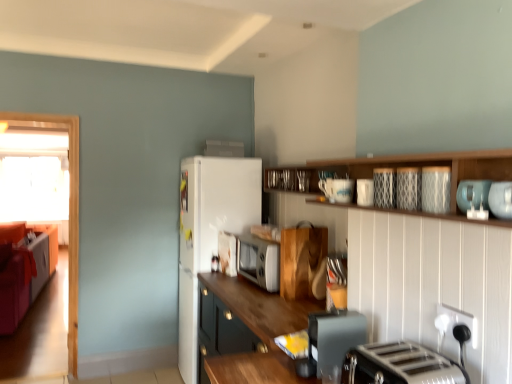
Measure the distance between point (340, 357) and camera.

4.92 feet.

Where is `wooden cutting board at center, which is the first cabinetry in top-to-bottom order`? wooden cutting board at center, which is the first cabinetry in top-to-bottom order is located at coordinates (303, 261).

How much space does porcelain textured mug at upper center, acting as the 2th appliance starting from the front, occupy vertically?

5.34 inches.

What do you see at coordinates (400, 365) in the screenshot? I see `silver metallic toaster at lower right` at bounding box center [400, 365].

What do you see at coordinates (209, 231) in the screenshot? I see `white matte refrigerator at left` at bounding box center [209, 231].

In order to click on white matte refrigerator at left in this screenshot , I will do `click(209, 231)`.

I want to click on velvet orange couch at left, so click(23, 268).

Can you confirm if silver metallic toaster at lower right is positioned to the right of wooden cutting board at center, which is the second cabinetry from bottom to top?

Correct, you'll find silver metallic toaster at lower right to the right of wooden cutting board at center, which is the second cabinetry from bottom to top.

From the image's perspective, would you say silver metallic toaster at lower right is positioned over wooden cutting board at center, which is the second cabinetry from bottom to top?

No, from the image's perspective, silver metallic toaster at lower right is not over wooden cutting board at center, which is the second cabinetry from bottom to top.

Is silver metallic toaster at lower right oriented towards wooden cutting board at center, the 1th cabinetry positioned from the back?

No, silver metallic toaster at lower right is not aimed at wooden cutting board at center, the 1th cabinetry positioned from the back.

Choose the correct answer: Is silver metallic toaster at lower right inside wooden cutting board at center, the 1th cabinetry positioned from the back, or outside it?

silver metallic toaster at lower right is located beyond the bounds of wooden cutting board at center, the 1th cabinetry positioned from the back.

From the image's perspective, is white matte refrigerator at upper center, the 7th appliance ordered from the bottom, located beneath metallic gray toaster at lower center, the fourth appliance from the back?

No, from the image's perspective, white matte refrigerator at upper center, the 7th appliance ordered from the bottom, is not beneath metallic gray toaster at lower center, the fourth appliance from the back.

From the picture: Is white matte refrigerator at upper center, which appears as the 7th appliance when viewed from the front, inside the boundaries of metallic gray toaster at lower center, the fourth appliance from the back, or outside?

The correct answer is: outside.

You are a GUI agent. You are given a task and a screenshot of the screen. Output one action in this format:
    pyautogui.click(x=<x>, y=<y>)
    Task: Click on the 6th appliance below when counting from the white matte refrigerator at upper center, which appears as the 7th appliance when viewed from the front (from the image's perspective)
    This screenshot has height=384, width=512.
    Given the screenshot: What is the action you would take?
    pyautogui.click(x=333, y=340)

Considering their positions, is white matte refrigerator at upper center, which appears as the 7th appliance when viewed from the front, located in front of or behind metallic gray toaster at lower center, acting as the seventh appliance starting from the top?

white matte refrigerator at upper center, which appears as the 7th appliance when viewed from the front, is behind metallic gray toaster at lower center, acting as the seventh appliance starting from the top.

Considering the relative positions of blue glossy toaster at upper right, acting as the 1th appliance starting from the front, and white matte refrigerator at left in the image provided, is blue glossy toaster at upper right, acting as the 1th appliance starting from the front, to the right of white matte refrigerator at left from the viewer's perspective?

Yes.

Is white matte refrigerator at left completely or partially inside blue glossy toaster at upper right, which is counted as the 4th appliance, starting from the bottom?

No, white matte refrigerator at left is not surrounded by blue glossy toaster at upper right, which is counted as the 4th appliance, starting from the bottom.

From a real-world perspective, is blue glossy toaster at upper right, which is counted as the 4th appliance, starting from the bottom, located higher than white matte refrigerator at left?

Yes, from a real-world perspective, blue glossy toaster at upper right, which is counted as the 4th appliance, starting from the bottom, is over white matte refrigerator at left

Is blue glossy toaster at upper right, acting as the 1th appliance starting from the front, bigger or smaller than white matte refrigerator at left?

In the image, blue glossy toaster at upper right, acting as the 1th appliance starting from the front, appears to be smaller than white matte refrigerator at left.

From the image's perspective, which one is positioned higher, silver metallic toaster at lower right or white frosted glass window at left?

From the image's view, white frosted glass window at left is above.

From a real-world perspective, which object stands above the other?

From a 3D spatial view, white frosted glass window at left is above.

Consider the image. Can you tell me how much silver metallic toaster at lower right and white frosted glass window at left differ in facing direction?

93.4 degrees separate the facing orientations of silver metallic toaster at lower right and white frosted glass window at left.

Would you say white frosted glass window at left is part of silver metallic toaster at lower right's contents?

No, white frosted glass window at left is not surrounded by silver metallic toaster at lower right.

Is wooden cabinet at center, acting as the 2th cabinetry starting from the back, beside white matte refrigerator at upper center, the 1th appliance from the top?

No, wooden cabinet at center, acting as the 2th cabinetry starting from the back, is not in contact with white matte refrigerator at upper center, the 1th appliance from the top.

What's the angular difference between wooden cabinet at center, which ranks as the second cabinetry in top-to-bottom order, and white matte refrigerator at upper center, the 7th appliance ordered from the bottom,'s facing directions?

wooden cabinet at center, which ranks as the second cabinetry in top-to-bottom order, and white matte refrigerator at upper center, the 7th appliance ordered from the bottom, are facing 9.83 degrees away from each other.

Looking at their sizes, would you say wooden cabinet at center, the 1th cabinetry positioned from the front, is wider or thinner than white matte refrigerator at upper center, which appears as the 7th appliance when viewed from the front?

In the image, wooden cabinet at center, the 1th cabinetry positioned from the front, appears to be wider than white matte refrigerator at upper center, which appears as the 7th appliance when viewed from the front.

From a real-world perspective, between wooden cabinet at center, which is counted as the 1th cabinetry, starting from the bottom, and white matte refrigerator at upper center, the 7th appliance ordered from the bottom, who is vertically higher?

white matte refrigerator at upper center, the 7th appliance ordered from the bottom, is physically above.

From the image's perspective, which one is positioned lower, white matte refrigerator at upper center, which appears as the 7th appliance when viewed from the front, or white frosted glass window at left?

From the image's view, white frosted glass window at left is below.

From a real-world perspective, is white matte refrigerator at upper center, the 1th appliance from the top, above or below white frosted glass window at left?

From a real-world perspective, white matte refrigerator at upper center, the 1th appliance from the top, is physically above white frosted glass window at left.

Is point (223, 145) in front of point (54, 195)?

That is True.

Can you tell me how much velvet orange couch at left and wooden cabinet at center, acting as the 2th cabinetry starting from the back, differ in facing direction?

The angular difference between velvet orange couch at left and wooden cabinet at center, acting as the 2th cabinetry starting from the back, is 5.32 degrees.

From the image's perspective, is velvet orange couch at left positioned above or below wooden cabinet at center, which is counted as the 1th cabinetry, starting from the bottom?

velvet orange couch at left is situated higher than wooden cabinet at center, which is counted as the 1th cabinetry, starting from the bottom, in the image.

From a real-world perspective, is velvet orange couch at left on top of wooden cabinet at center, which ranks as the second cabinetry in top-to-bottom order?

No, from a real-world perspective, velvet orange couch at left is not on top of wooden cabinet at center, which ranks as the second cabinetry in top-to-bottom order.

Does velvet orange couch at left have a greater height compared to wooden cabinet at center, acting as the 2th cabinetry starting from the back?

Yes.

This screenshot has width=512, height=384. I want to click on the 1st cabinetry to the left of the silver metallic toaster at lower right, counting from the anchor's position, so (303, 261).

You are a GUI agent. You are given a task and a screenshot of the screen. Output one action in this format:
    pyautogui.click(x=<x>, y=<y>)
    Task: Click on the 6th appliance below the white matte refrigerator at upper center, the 1th appliance from the back (from the image's perspective)
    
    Given the screenshot: What is the action you would take?
    pyautogui.click(x=333, y=340)

Looking at the image, which one is located further to white matte refrigerator at upper center, the 1th appliance from the back, white glossy microwave at center, which appears as the 2th appliance when viewed from the back, or silver metallic toaster at lower right?

silver metallic toaster at lower right is positioned further to the anchor white matte refrigerator at upper center, the 1th appliance from the back.

Estimate the real-world distances between objects in this image. Which object is closer to transparent glass door at left, silver metallic toaster at lower right or blue glossy toaster at upper right, which ranks as the fourth appliance in top-to-bottom order?

silver metallic toaster at lower right.

From the image, which object appears to be farther from wooden microwave at center, acting as the 6th appliance starting from the top, metallic gray toaster at lower center, acting as the seventh appliance starting from the top, or blue glossy toaster at upper right, the 7th appliance viewed from the back?

blue glossy toaster at upper right, the 7th appliance viewed from the back, is positioned further to the anchor wooden microwave at center, acting as the 6th appliance starting from the top.

Estimate the real-world distances between objects in this image. Which object is further from blue glossy toaster at upper right, which ranks as the fourth appliance in top-to-bottom order, patterned ceramic plate at upper center, the 3th appliance viewed from the front, or white glossy microwave at center, which appears as the 2th appliance when viewed from the back?

white glossy microwave at center, which appears as the 2th appliance when viewed from the back, lies further to blue glossy toaster at upper right, which ranks as the fourth appliance in top-to-bottom order, than the other object.

When comparing their distances from blue glossy toaster at upper right, which ranks as the fourth appliance in top-to-bottom order, does silver metallic toaster at lower right or wooden cabinet at center, acting as the 2th cabinetry starting from the back, seem further?

wooden cabinet at center, acting as the 2th cabinetry starting from the back.

Based on their spatial positions, is white glossy microwave at center, arranged as the 6th appliance when viewed from the front, or porcelain textured mug at upper center, arranged as the fifth appliance when ordered from the bottom, further from white matte refrigerator at upper center, the 1th appliance from the back?

Among the two, porcelain textured mug at upper center, arranged as the fifth appliance when ordered from the bottom, is located further to white matte refrigerator at upper center, the 1th appliance from the back.

Considering their positions, is porcelain textured mug at upper center, arranged as the fifth appliance when ordered from the bottom, positioned further to transparent glass door at left than metallic gray toaster at lower center, acting as the first appliance starting from the bottom?

porcelain textured mug at upper center, arranged as the fifth appliance when ordered from the bottom, is positioned further to the anchor transparent glass door at left.

Looking at the image, which one is located further to transparent glass door at left, wooden cabinet at center, which is counted as the 1th cabinetry, starting from the bottom, or white frosted glass window at left?

white frosted glass window at left lies further to transparent glass door at left than the other object.

Locate an element on the screen. The image size is (512, 384). fridge between blue glossy toaster at upper right, which ranks as the fourth appliance in top-to-bottom order, and white frosted glass window at left from front to back is located at coordinates (209, 231).

At what (x,y) coordinates should I click in order to perform the action: click on fridge situated between velvet orange couch at left and metallic gray toaster at lower center, acting as the seventh appliance starting from the top, from left to right. Please return your answer as a coordinate pair (x, y). Looking at the image, I should click on (209, 231).

Where is `couch between metallic gray toaster at lower center, placed as the fourth appliance when sorted from front to back, and white frosted glass window at left from front to back`? couch between metallic gray toaster at lower center, placed as the fourth appliance when sorted from front to back, and white frosted glass window at left from front to back is located at coordinates (23, 268).

Identify the location of glass door located between wooden microwave at center, which is counted as the 3th appliance, starting from the back, and white frosted glass window at left in the depth direction. This screenshot has width=512, height=384. (69, 210).